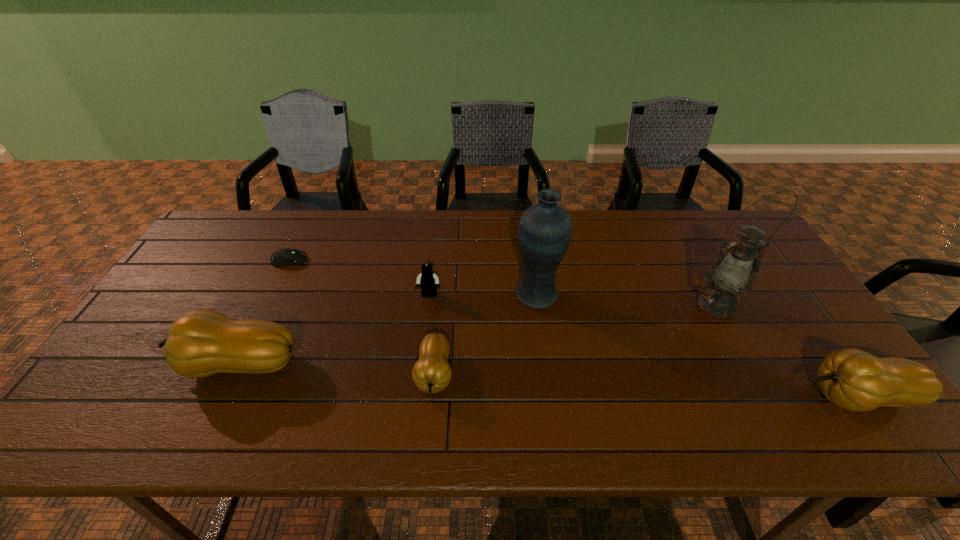
Where is `object at the left edge`? The width and height of the screenshot is (960, 540). object at the left edge is located at coordinates (205, 342).

Where is `object that is at the right edge`? object that is at the right edge is located at coordinates (852, 379).

Image resolution: width=960 pixels, height=540 pixels. In order to click on object that is positioned at the near left corner in this screenshot , I will do 205,342.

Locate an element on the screen. This screenshot has height=540, width=960. object present at the near right corner is located at coordinates (852, 379).

Identify the location of vacant area at the far edge. The width and height of the screenshot is (960, 540). (299, 214).

Locate an element on the screen. The image size is (960, 540). vacant region at the near edge of the desktop is located at coordinates (583, 388).

In the image, there is a desktop. Where is `vacant space at the left edge`? Image resolution: width=960 pixels, height=540 pixels. vacant space at the left edge is located at coordinates (165, 312).

The height and width of the screenshot is (540, 960). In the image, there is a desktop. Find the location of `free space at the right edge`. free space at the right edge is located at coordinates (769, 342).

This screenshot has width=960, height=540. I want to click on free point at the far left corner, so click(x=228, y=224).

At what (x,y) coordinates should I click in order to perform the action: click on vacant region at the near left corner of the desktop. Please return your answer as a coordinate pair (x, y). The image size is (960, 540). Looking at the image, I should click on (92, 396).